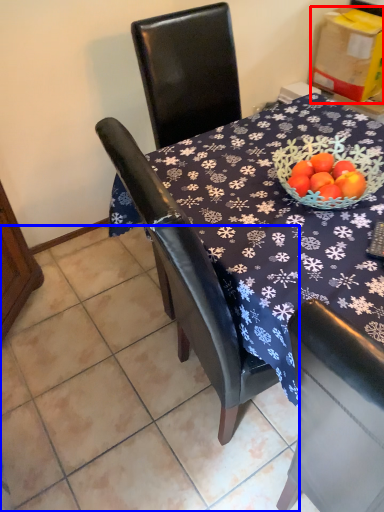
Question: Which of the following is the farthest to the observer, cardboard box (highlighted by a red box) or tile (highlighted by a blue box)?

Choices:
 (A) cardboard box
 (B) tile

Answer: (A)